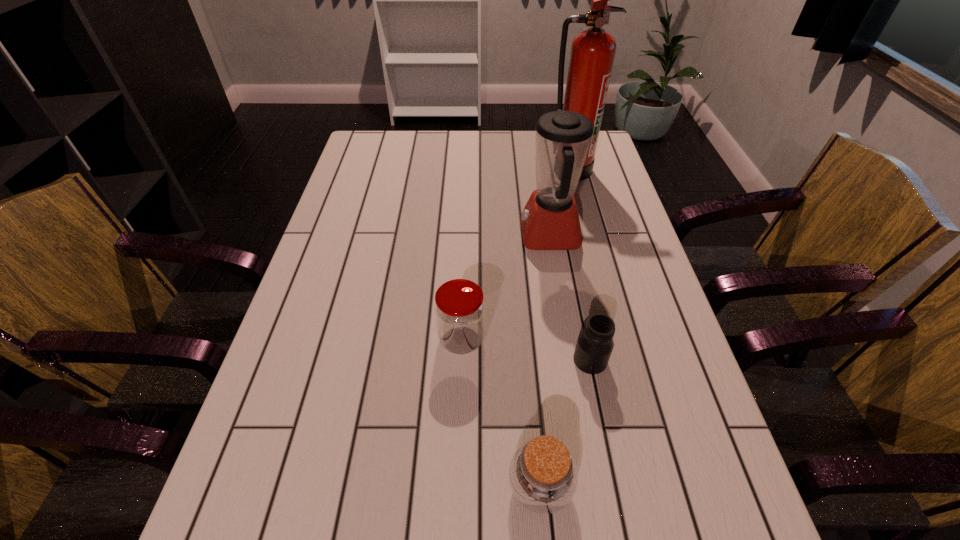
Locate an element on the screen. vacant space located on the front of the second tallest object near the controls is located at coordinates (492, 235).

This screenshot has width=960, height=540. What are the coordinates of `free space located on the front of the second tallest object near the controls` in the screenshot? It's located at pos(498,235).

Find the location of a particular element. This screenshot has width=960, height=540. vacant space located 0.380m on the front of the second tallest object near the controls is located at coordinates point(384,235).

Locate an element on the screen. The width and height of the screenshot is (960, 540). free space located 0.330m on the back of the tallest jar is located at coordinates (466, 230).

You are a GUI agent. You are given a task and a screenshot of the screen. Output one action in this format:
    pyautogui.click(x=<x>, y=<y>)
    Task: Click on the free space located on the back of the rightmost jar
    Image resolution: width=960 pixels, height=540 pixels.
    Given the screenshot: What is the action you would take?
    pyautogui.click(x=578, y=302)

Find the location of a particular element. Image resolution: width=960 pixels, height=540 pixels. free space located 0.100m on the right of the second jar from right to left is located at coordinates (631, 487).

What are the coordinates of `object situated at the far edge` in the screenshot? It's located at (592, 55).

The image size is (960, 540). I want to click on fire extinguisher at the right edge, so click(592, 55).

You are a GUI agent. You are given a task and a screenshot of the screen. Output one action in this format:
    pyautogui.click(x=<x>, y=<y>)
    Task: Click on the blender situated at the right edge
    Image resolution: width=960 pixels, height=540 pixels.
    Given the screenshot: What is the action you would take?
    (549, 221)

The image size is (960, 540). I want to click on object situated at the far right corner, so click(592, 55).